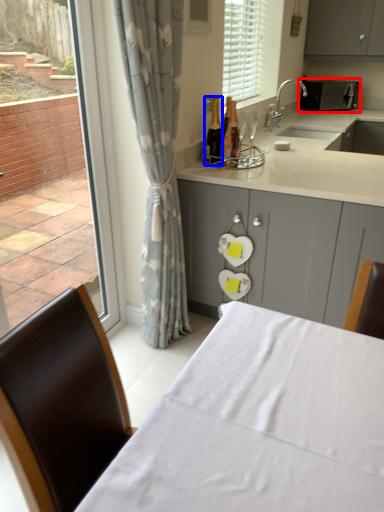
Question: Which object appears farthest to the camera in this image, appliance (highlighted by a red box) or bottle (highlighted by a blue box)?

Choices:
 (A) appliance
 (B) bottle

Answer: (A)